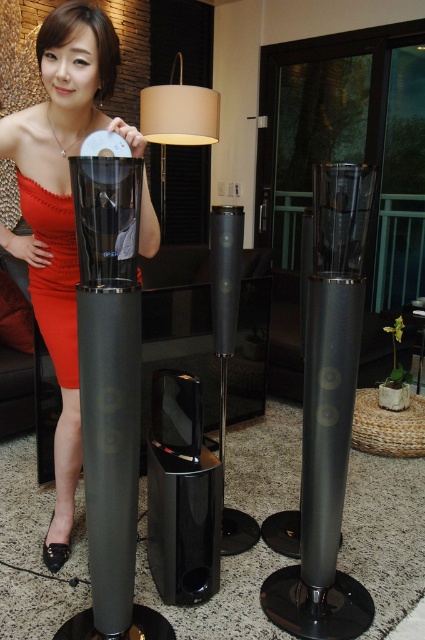
You are a photographer setting up for a product shoot. You need to place a small potted plant exactly at the coordinates specified by point (328,413). However, there is already an object at that location. What object is blocking the placement of the potted plant at those coordinates?

The glossy black speaker at center is blocking the placement of the potted plant at point (328,413) as the point marks its location.

You are a photographer setting up for a photoshoot in the living room. You need to position a model wearing the matte red dress at left so that the glossy black speaker at center is visible in the background. Based on their current positions, will the speaker be visible behind the model?

The glossy black speaker at center is positioned on the right side of matte red dress at left, so if the model stands where the dress is currently placed, the speaker would be to the right of the model and thus visible in the background.

In the living room scene, there is a woman in a vibrant red strapless dress holding a CD and a point labeled at coordinates (61, 212). What object is located at that coordinate?

The point at coordinates (61, 212) corresponds to the matte black dress at center.